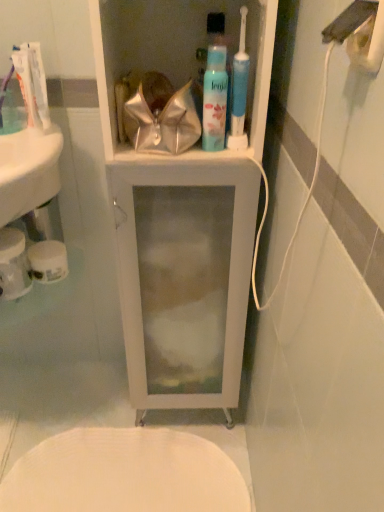
Locate an element on the screen. The width and height of the screenshot is (384, 512). vacant space situated above white textured toilet at lower center (from a real-world perspective) is located at coordinates (124, 461).